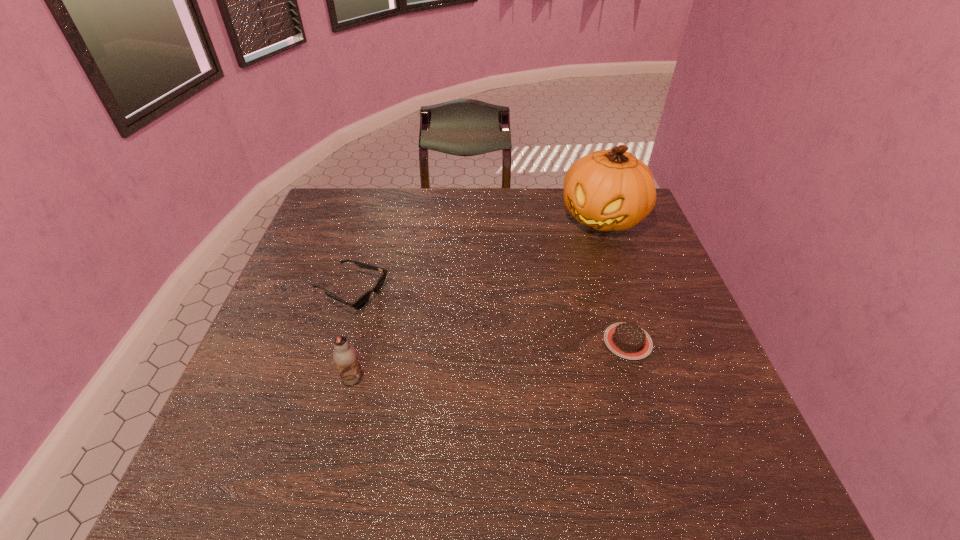
At what (x,y) coordinates should I click in order to perform the action: click on object located in the far right corner section of the desktop. Please return your answer as a coordinate pair (x, y). Looking at the image, I should click on (611, 189).

Locate an element on the screen. The image size is (960, 540). vacant space at the far edge of the desktop is located at coordinates (522, 204).

What are the coordinates of `vacant space at the near edge of the desktop` in the screenshot? It's located at (490, 401).

In the image, there is a desktop. Where is `vacant space at the left edge`? vacant space at the left edge is located at coordinates (300, 326).

At what (x,y) coordinates should I click in order to perform the action: click on blank space at the right edge. Please return your answer as a coordinate pair (x, y). Looking at the image, I should click on (676, 296).

Where is `free space at the far left corner`? The height and width of the screenshot is (540, 960). free space at the far left corner is located at coordinates (364, 199).

Image resolution: width=960 pixels, height=540 pixels. Identify the location of free space between the nearest object and the second shortest object. (352, 335).

You are a GUI agent. You are given a task and a screenshot of the screen. Output one action in this format:
    pyautogui.click(x=<x>, y=<y>)
    Task: Click on the blank region between the farthest object and the chocolate cake
    The height and width of the screenshot is (540, 960).
    Given the screenshot: What is the action you would take?
    pyautogui.click(x=615, y=279)

Where is `vacant space that's between the tallest object and the second nearest object`? The height and width of the screenshot is (540, 960). vacant space that's between the tallest object and the second nearest object is located at coordinates (615, 279).

The height and width of the screenshot is (540, 960). What are the coordinates of `free space that is in between the nearest object and the second farthest object` in the screenshot? It's located at (352, 335).